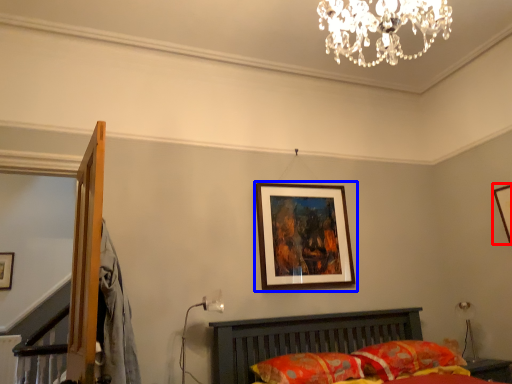
Question: Which object appears closest to the camera in this image, picture frame (highlighted by a red box) or picture frame (highlighted by a blue box)?

Choices:
 (A) picture frame
 (B) picture frame

Answer: (B)